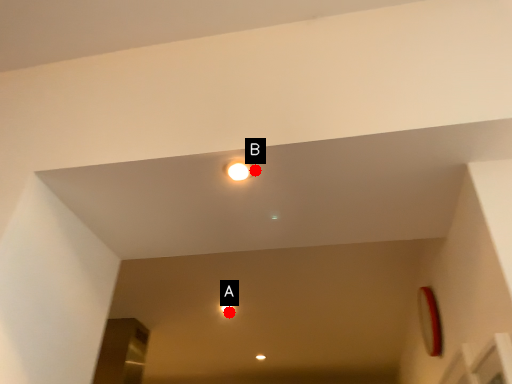
Question: Two points are circled on the image, labeled by A and B beside each circle. Which point is further to the camera?

Choices:
 (A) A is further
 (B) B is further

Answer: (A)